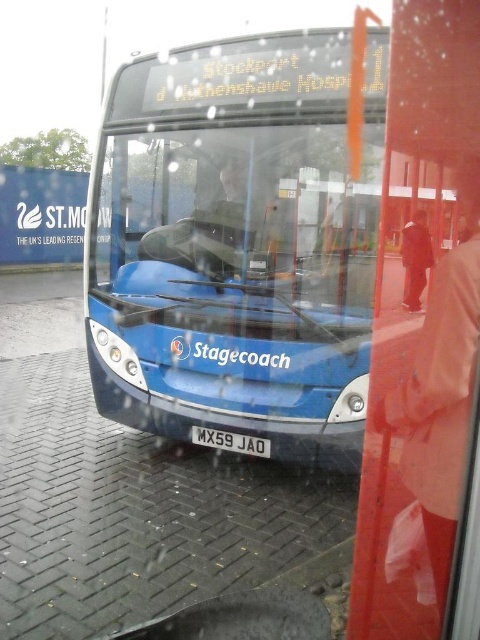
From the picture: You are standing at the bus stop and want to board the blue metallic bus at center. Given that the bus stop has a boarding area marked at point 0.5 on the coordinate system, can you determine if you are within the boarding zone?

The blue metallic bus at center is located at point 0.381 on the coordinate system, which is before the boarding area marked at 0.5. Therefore, you are not within the boarding zone yet.

You are a delivery person trying to determine if your 1.8 meters tall package can fit vertically inside the blue metallic bus at center. You notice the white plastic license plate at center. Can you estimate if the package will fit based on the height comparison?

The blue metallic bus at center is much taller than the white plastic license plate at center. Since the license plate is at the front of the bus, the bus has sufficient height to accommodate a 1.8 meters tall package vertically.

You are a passenger on the bus and want to see the destination sign above the windshield. Is the transparent glass at center blocking your view?

The transparent glass at center is at point (x=237, y=220), so it is blocking your view of the destination sign above the windshield.